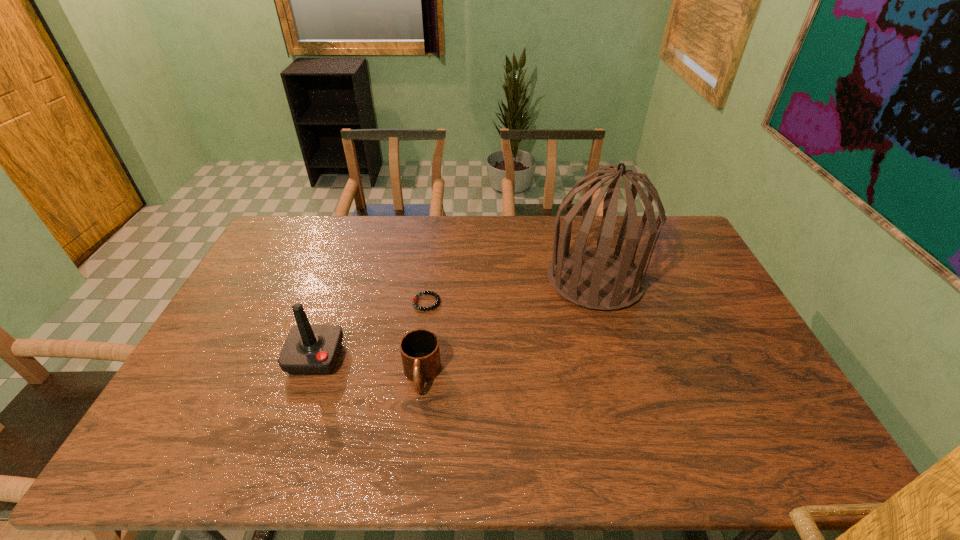
Find the location of `the tallest object`. the tallest object is located at coordinates (597, 278).

Find the location of a particular element. The width and height of the screenshot is (960, 540). the rightmost object is located at coordinates (597, 278).

The image size is (960, 540). Find the location of `joystick`. joystick is located at coordinates (309, 349).

You are a GUI agent. You are given a task and a screenshot of the screen. Output one action in this format:
    pyautogui.click(x=<x>, y=<y>)
    Task: Click on the leftmost object
    Image resolution: width=960 pixels, height=540 pixels.
    Given the screenshot: What is the action you would take?
    pyautogui.click(x=309, y=349)

What are the coordinates of `mug` in the screenshot? It's located at (420, 352).

Image resolution: width=960 pixels, height=540 pixels. Find the location of `bracelet`. bracelet is located at coordinates (415, 300).

I want to click on vacant space located on the front of the rightmost object, so click(x=610, y=331).

Identify the location of free space located 0.280m on the back of the joystick. This screenshot has width=960, height=540. [x=345, y=276].

Identify the location of free space located 0.160m on the side of the third tallest object with the handle. The height and width of the screenshot is (540, 960). (411, 461).

This screenshot has height=540, width=960. Identify the location of vacant space located 0.250m on the front of the bracelet. (417, 379).